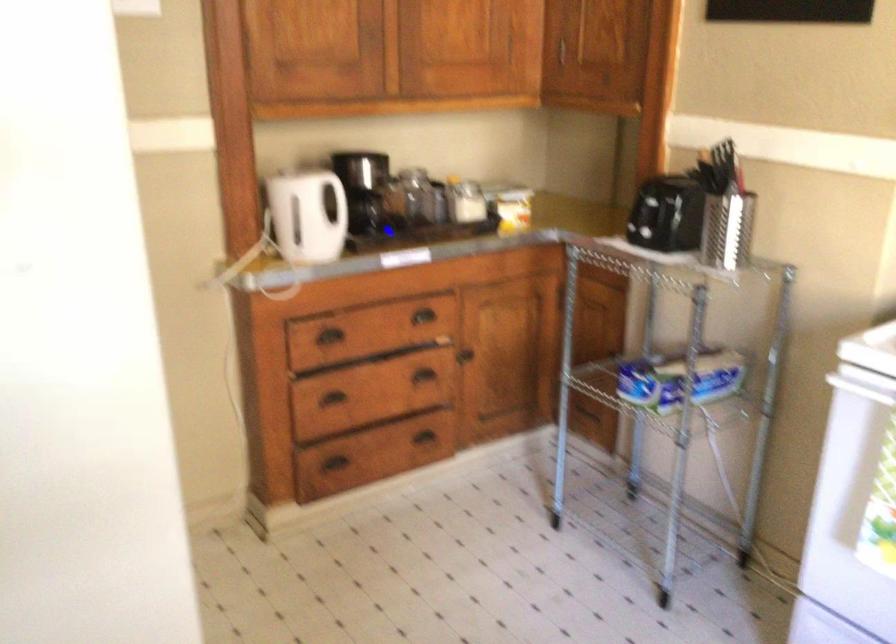
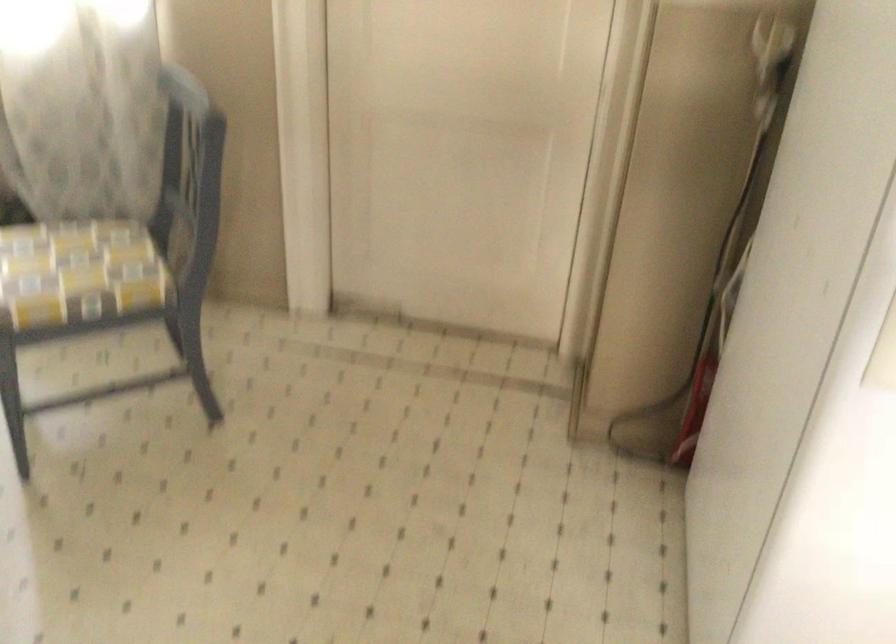
Question: The camera is either moving clockwise (left) or counter-clockwise (right) around the object. The first image is from the beginning of the video and the second image is from the end. Is the camera moving left or right when shooting the video?

Choices:
 (A) Left
 (B) Right

Answer: (B)